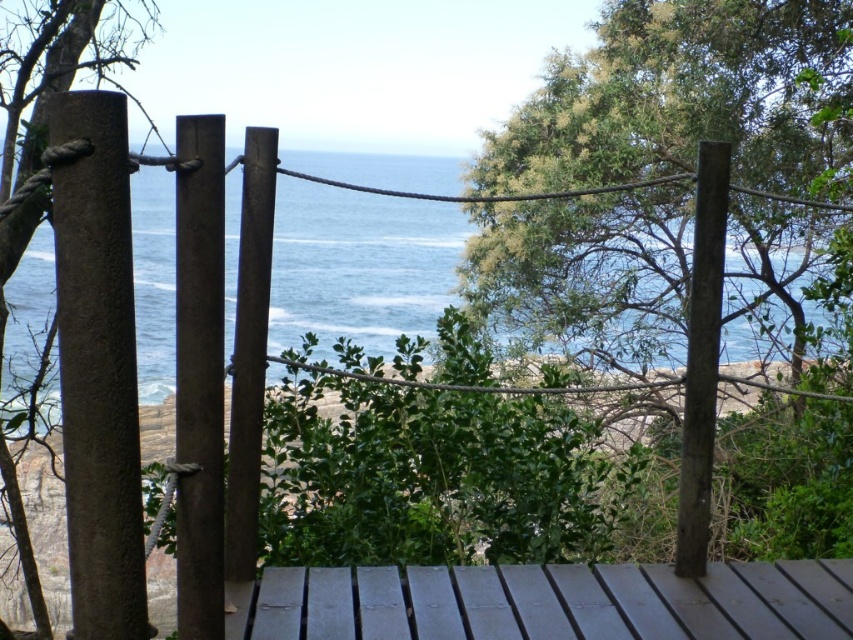
You are standing on the wooden platform and looking out at the two green leafy trees. Which tree is positioned higher in the scene, the green leafy tree at center or the green leafy tree at left?

The green leafy tree at center is positioned higher than the green leafy tree at left in the scene.

You are standing on the smooth dark wood deck at center and want to look at the green leafy tree at left. In which direction should you turn your head to see it?

You should turn your head to the left to see the green leafy tree at left because the smooth dark wood deck at center is to its right.